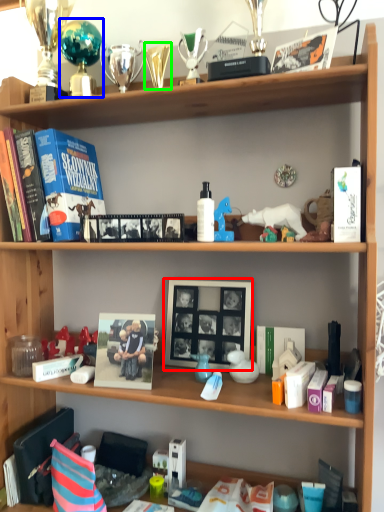
Question: Estimate the real-world distances between objects in this image. Which object is farther from picture frame (highlighted by a red box), toy (highlighted by a blue box) or toy (highlighted by a green box)?

Choices:
 (A) toy
 (B) toy

Answer: (A)